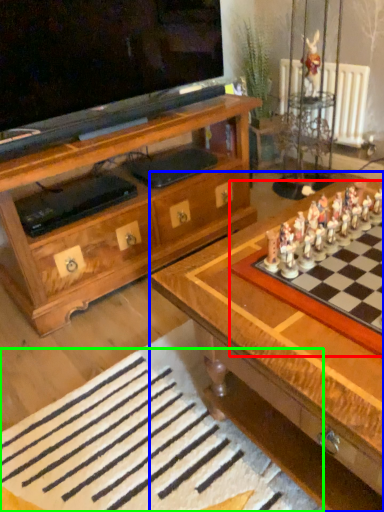
Question: Which is farther away from board game (highlighted by a red box)? table (highlighted by a blue box) or board (highlighted by a green box)?

Choices:
 (A) table
 (B) board

Answer: (B)